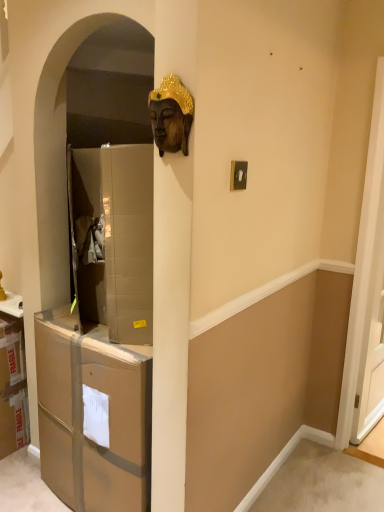
Measure the distance between brown cardboard drawer at left and camera.

A distance of 4.68 feet exists between brown cardboard drawer at left and camera.

Identify the location of bronze statue at upper center. (171, 115).

This screenshot has width=384, height=512. What do you see at coordinates (171, 115) in the screenshot?
I see `bronze statue at upper center` at bounding box center [171, 115].

At what (x,y) coordinates should I click in order to perform the action: click on brown cardboard drawer at left. Please return your answer as a coordinate pair (x, y). Image resolution: width=384 pixels, height=512 pixels. Looking at the image, I should click on (83, 416).

Which object is closer to the camera, white glossy screen door at right or brown cardboard drawer at left?

brown cardboard drawer at left.

Can you confirm if white glossy screen door at right is shorter than brown cardboard drawer at left?

No, white glossy screen door at right is not shorter than brown cardboard drawer at left.

Is brown cardboard drawer at left surrounded by white glossy screen door at right?

No, brown cardboard drawer at left is not a part of white glossy screen door at right.

Is point (98, 337) closer or farther from the camera than point (351, 408)?

Clearly, point (98, 337) is closer to the camera than point (351, 408).

Can you confirm if brown cardboard drawer at left is wider than white glossy screen door at right?

Yes, brown cardboard drawer at left is wider than white glossy screen door at right.

Who is smaller, brown cardboard drawer at left or white glossy screen door at right?

Smaller between the two is white glossy screen door at right.

Considering their positions, is brown cardboard drawer at left located in front of or behind white glossy screen door at right?

brown cardboard drawer at left is positioned closer to the viewer than white glossy screen door at right.

Does point (64, 333) come behind point (165, 84)?

Yes, point (64, 333) is farther from viewer.

Does brown cardboard drawer at left contain bronze statue at upper center?

No, bronze statue at upper center is not inside brown cardboard drawer at left.

Looking at their sizes, would you say brown cardboard drawer at left is wider or thinner than bronze statue at upper center?

Clearly, brown cardboard drawer at left has more width compared to bronze statue at upper center.

Between brown cardboard drawer at left and bronze statue at upper center, which one appears on the right side from the viewer's perspective?

From the viewer's perspective, bronze statue at upper center appears more on the right side.

From a real-world perspective, which object rests below the other?

In real-world perspective, brown cardboard drawer at left is lower.

Is point (187, 113) positioned behind point (48, 385)?

No.

Is bronze statue at upper center oriented towards brown cardboard drawer at left?

No, bronze statue at upper center is not oriented towards brown cardboard drawer at left.

Which object is positioned more to the right, bronze statue at upper center or brown cardboard drawer at left?

From the viewer's perspective, bronze statue at upper center appears more on the right side.

Consider the image. Does white glossy screen door at right have a lesser width compared to bronze statue at upper center?

No.

Is the depth of white glossy screen door at right greater than that of bronze statue at upper center?

That is True.

Can you confirm if white glossy screen door at right is positioned to the left of bronze statue at upper center?

No, white glossy screen door at right is not to the left of bronze statue at upper center.

Is white glossy screen door at right spatially inside bronze statue at upper center, or outside of it?

white glossy screen door at right is not inside bronze statue at upper center, it's outside.

Is point (165, 136) positioned after point (364, 310)?

No, it is not.

What's the angular difference between bronze statue at upper center and white glossy screen door at right's facing directions?

The angle between the facing direction of bronze statue at upper center and the facing direction of white glossy screen door at right is 84 degrees.

Does bronze statue at upper center have a greater height compared to white glossy screen door at right?

No.

Is bronze statue at upper center wider or thinner than white glossy screen door at right?

Clearly, bronze statue at upper center has less width compared to white glossy screen door at right.

In the image, there is a white glossy screen door at right. Where is `drawer below it (from a real-world perspective)`? This screenshot has width=384, height=512. drawer below it (from a real-world perspective) is located at coordinates (83, 416).

Find the location of `screen door above the brown cardboard drawer at left (from a real-world perspective)`. screen door above the brown cardboard drawer at left (from a real-world perspective) is located at coordinates (365, 281).

Based on their spatial positions, is bronze statue at upper center or white glossy screen door at right closer to brown cardboard drawer at left?

The object closer to brown cardboard drawer at left is bronze statue at upper center.

Which object lies further to the anchor point bronze statue at upper center, brown cardboard drawer at left or white glossy screen door at right?

white glossy screen door at right is positioned further to the anchor bronze statue at upper center.

Considering their positions, is brown cardboard drawer at left positioned further to white glossy screen door at right than bronze statue at upper center?

bronze statue at upper center is further to white glossy screen door at right.

From the picture: Based on their spatial positions, is white glossy screen door at right or brown cardboard drawer at left closer to bronze statue at upper center?

Among the two, brown cardboard drawer at left is located nearer to bronze statue at upper center.

Which object lies nearer to the anchor point brown cardboard drawer at left, white glossy screen door at right or bronze statue at upper center?

Among the two, bronze statue at upper center is located nearer to brown cardboard drawer at left.

Based on their spatial positions, is bronze statue at upper center or brown cardboard drawer at left closer to white glossy screen door at right?

Based on the image, brown cardboard drawer at left appears to be nearer to white glossy screen door at right.

This screenshot has height=512, width=384. Identify the location of bronze statue situated between brown cardboard drawer at left and white glossy screen door at right from left to right. (171, 115).